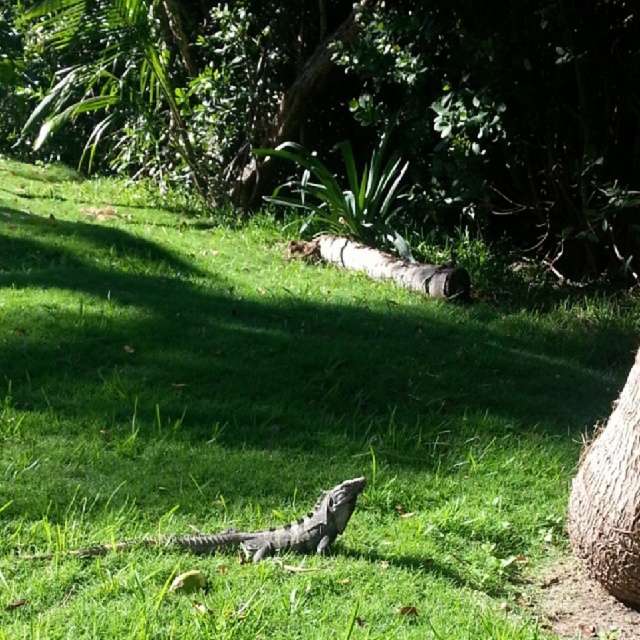
Between brown rough tree trunk at lower right and brown rough log at center, which one appears on the right side from the viewer's perspective?

Positioned to the right is brown rough tree trunk at lower right.

Consider the image. Does brown rough tree trunk at lower right have a greater height compared to brown rough log at center?

Correct, brown rough tree trunk at lower right is much taller as brown rough log at center.

Who is more distant from viewer, [609,458] or [396,280]?

The point [396,280] is behind.

The height and width of the screenshot is (640, 640). What are the coordinates of `brown rough tree trunk at lower right` in the screenshot? It's located at (611, 497).

Who is more distant from viewer, (544, 262) or (584, 499)?

Positioned behind is point (544, 262).

In the scene shown: Which is more to the right, green leafy tree at upper center or brown rough tree trunk at lower right?

brown rough tree trunk at lower right

From the picture: Who is more forward, (x=38, y=83) or (x=612, y=513)?

Positioned in front is point (x=612, y=513).

Image resolution: width=640 pixels, height=640 pixels. Find the location of `green leafy tree at upper center`. green leafy tree at upper center is located at coordinates (353, 108).

Is green scaly lizard at center thinner than brown rough log at center?

Indeed, green scaly lizard at center has a lesser width compared to brown rough log at center.

Which is in front, point (305, 524) or point (388, 269)?

Point (305, 524)

Where is `green scaly lizard at center`? The width and height of the screenshot is (640, 640). green scaly lizard at center is located at coordinates (256, 531).